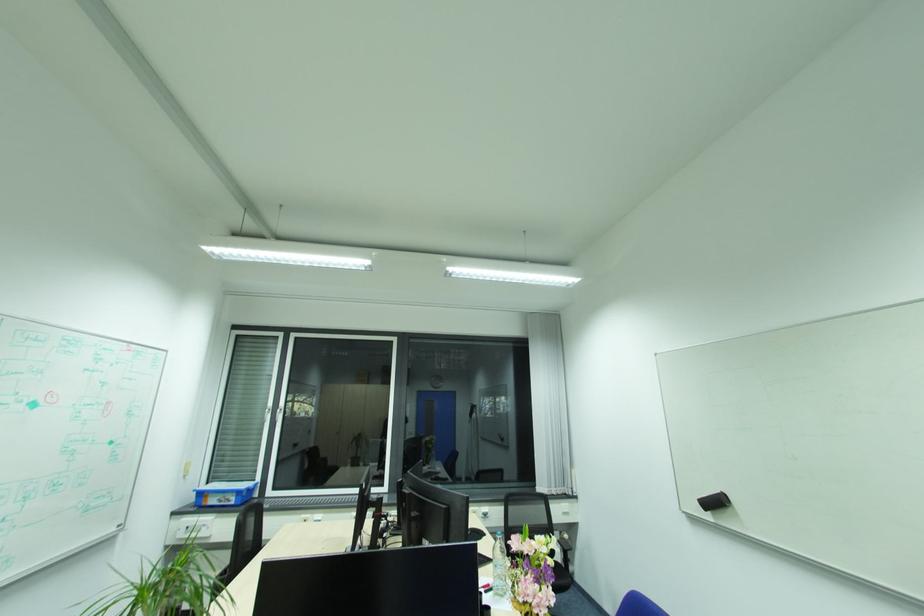
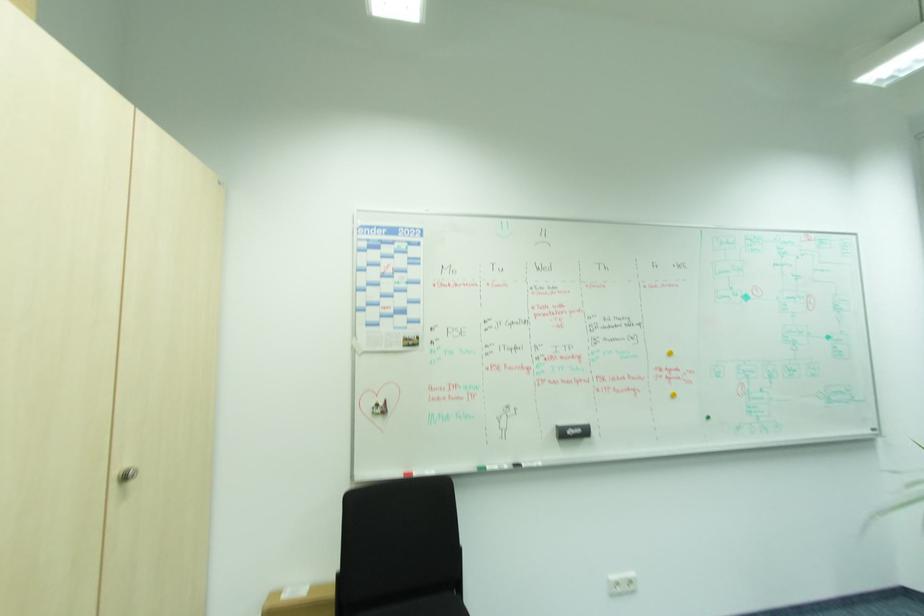
Question: The camera is either moving clockwise (left) or counter-clockwise (right) around the object. The first image is from the beginning of the video and the second image is from the end. Is the camera moving left or right when shooting the video?

Choices:
 (A) Left
 (B) Right

Answer: (B)